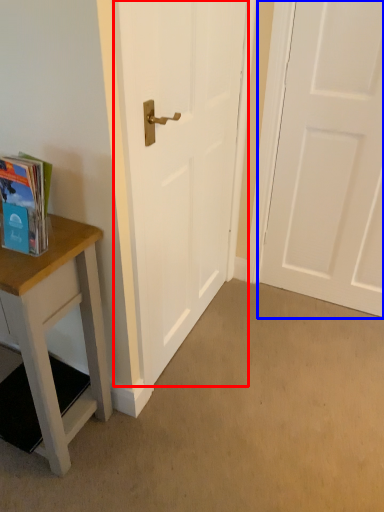
Question: Which of the following is the farthest to the observer, door (highlighted by a red box) or door (highlighted by a blue box)?

Choices:
 (A) door
 (B) door

Answer: (B)